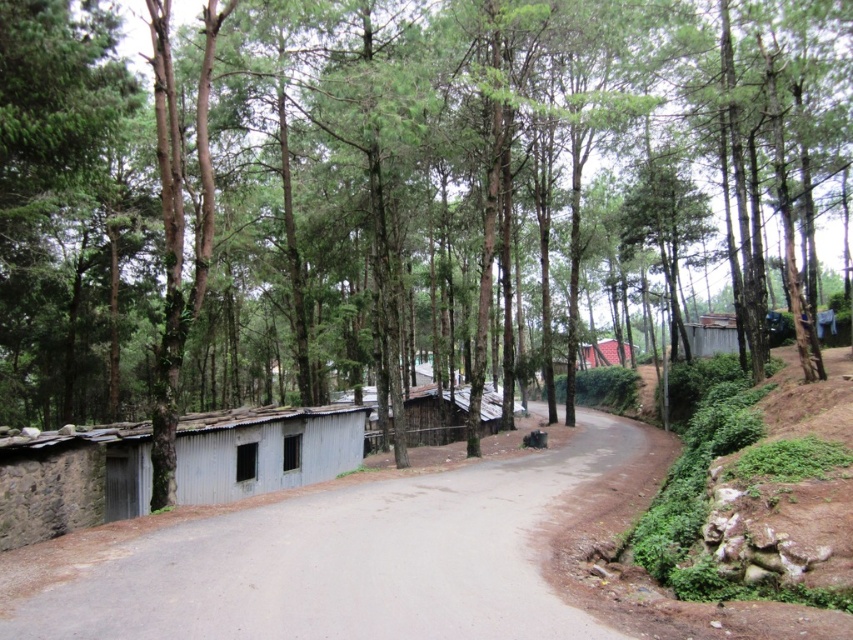
You are standing at the edge of the gray concrete road at center in the rural forest scene. There is a specific point marked at coordinates point (363,556). Is this point located on the road?

Yes, the point (363,556) is on the gray concrete road at center, so it is located on the road.